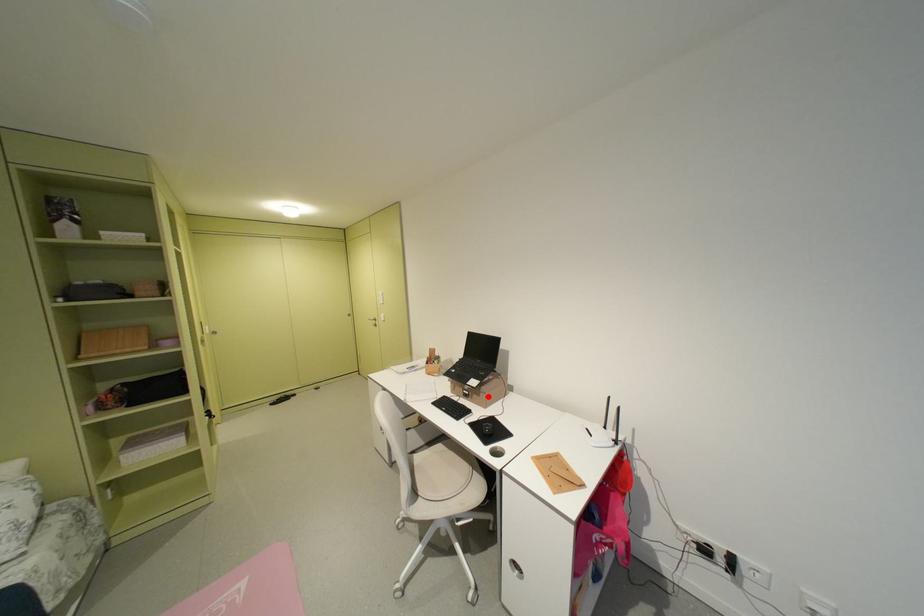
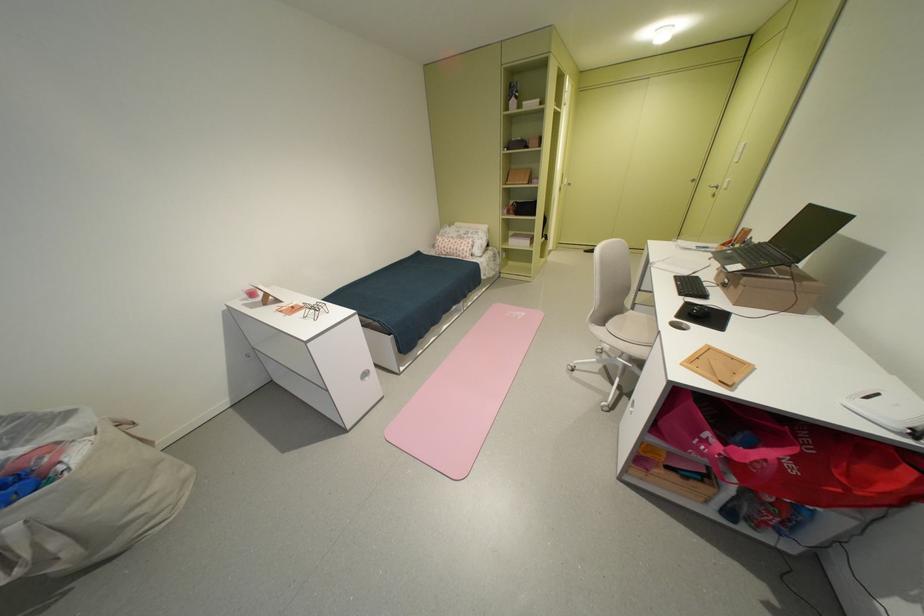
Question: I am providing you with two images of the same scene from different viewpoints. A red point is shown in image1. For the corresponding object point in image2, is it positioned nearer or farther from the camera?

Choices:
 (A) Nearer
 (B) Farther

Answer: (A)